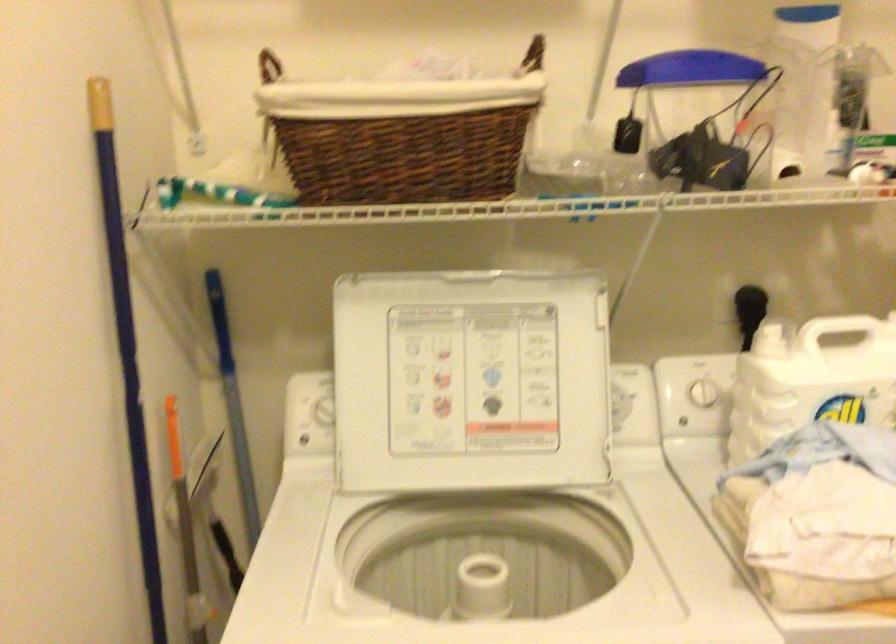
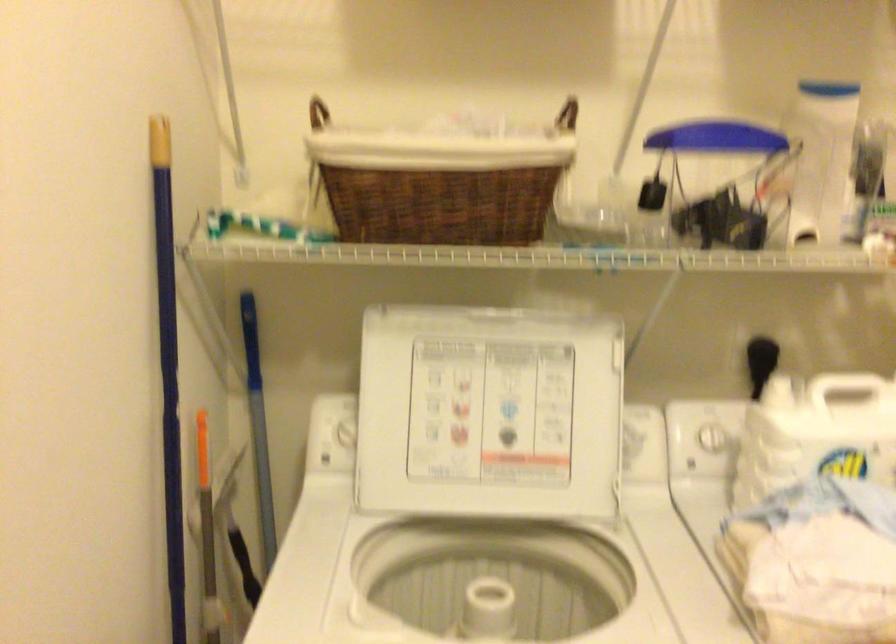
Question: In a continuous first-person perspective shot, in which direction is the camera moving?

Choices:
 (A) Left
 (B) Right
 (C) Forward
 (D) Backward

Answer: (D)